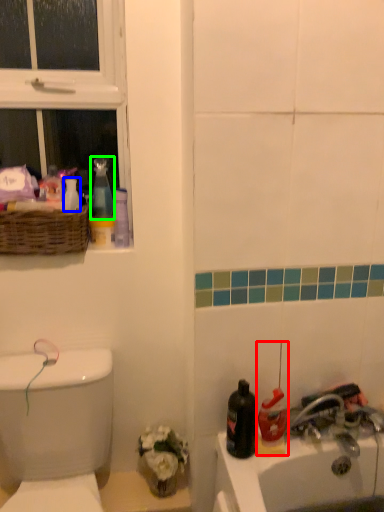
Question: Considering the real-world distances, which object is closest to cleaning product (highlighted by a red box)? toiletry (highlighted by a blue box) or cleaning product (highlighted by a green box).

Choices:
 (A) toiletry
 (B) cleaning product

Answer: (B)